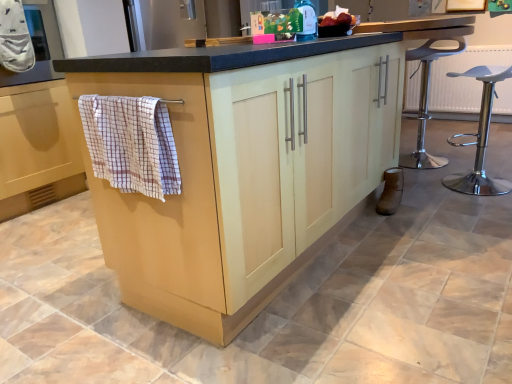
Find the location of a particular element. checkered fabric bath towel at left, the 1th bath towel when ordered from right to left is located at coordinates (131, 143).

What is the approximate height of checkered fabric bath towel at left, arranged as the 1th bath towel when viewed from the front?

The height of checkered fabric bath towel at left, arranged as the 1th bath towel when viewed from the front, is 12.49 inches.

Identify the location of green matte bottle at upper center. The height and width of the screenshot is (384, 512). (307, 20).

Find the location of `checkered fabric bath towel at left, arranged as the 1th bath towel when viewed from the front`. checkered fabric bath towel at left, arranged as the 1th bath towel when viewed from the front is located at coordinates (131, 143).

I want to click on the 2nd bath towel in front of the brown suede boot at lower right, so click(131, 143).

Considering the relative sizes of brown suede boot at lower right and checkered fabric bath towel at left, the 1th bath towel when ordered from right to left, in the image provided, is brown suede boot at lower right wider than checkered fabric bath towel at left, the 1th bath towel when ordered from right to left,?

In fact, brown suede boot at lower right might be narrower than checkered fabric bath towel at left, the 1th bath towel when ordered from right to left.

Is brown suede boot at lower right completely or partially outside of checkered fabric bath towel at left, acting as the 2th bath towel starting from the left?

brown suede boot at lower right lies outside checkered fabric bath towel at left, acting as the 2th bath towel starting from the left,'s area.

Who is smaller, brown suede boot at lower right or checkered fabric bath towel at left, the 2th bath towel in the back-to-front sequence?

brown suede boot at lower right.

Which of these two, brown suede boot at lower right or white plastic stool at right, stands shorter?

brown suede boot at lower right is shorter.

Which is in front, brown suede boot at lower right or white plastic stool at right?

white plastic stool at right is more forward.

Which of these two, brown suede boot at lower right or white plastic stool at right, is thinner?

brown suede boot at lower right.

From a real-world perspective, which is physically below, brown suede boot at lower right or white plastic stool at right?

brown suede boot at lower right is physically lower.

Based on the photo, how different are the orientations of white plastic stool at right and white cotton oven mitt at upper left, the 1th bath towel viewed from the left, in degrees?

The angular difference between white plastic stool at right and white cotton oven mitt at upper left, the 1th bath towel viewed from the left, is 166 degrees.

From a real-world perspective, between white plastic stool at right and white cotton oven mitt at upper left, the second bath towel when ordered from right to left, who is vertically higher?

white cotton oven mitt at upper left, the second bath towel when ordered from right to left, from a real-world perspective.

From the image's perspective, would you say white plastic stool at right is positioned over white cotton oven mitt at upper left, the first bath towel in the back-to-front sequence?

No, from the image's perspective, white plastic stool at right is not over white cotton oven mitt at upper left, the first bath towel in the back-to-front sequence.

Considering the relative sizes of white plastic stool at right and white cotton oven mitt at upper left, the second bath towel when ordered from right to left, in the image provided, is white plastic stool at right thinner than white cotton oven mitt at upper left, the second bath towel when ordered from right to left,?

No, white plastic stool at right is not thinner than white cotton oven mitt at upper left, the second bath towel when ordered from right to left.

Which of these two, matte gray oven at upper left or white plastic stool at right, is smaller?

white plastic stool at right.

I want to click on oven above the white plastic stool at right (from the image's perspective), so click(x=38, y=45).

Looking at this image, considering the sizes of objects matte gray oven at upper left and white plastic stool at right in the image provided, who is thinner, matte gray oven at upper left or white plastic stool at right?

Thinner between the two is white plastic stool at right.

Between white cotton oven mitt at upper left, the 1th bath towel viewed from the left, and green matte bottle at upper center, which one is positioned behind?

white cotton oven mitt at upper left, the 1th bath towel viewed from the left, is further from the camera.

Is point (13, 61) behind point (309, 27)?

Yes, it is.

Does white cotton oven mitt at upper left, the 1th bath towel viewed from the left, have a lesser height compared to green matte bottle at upper center?

In fact, white cotton oven mitt at upper left, the 1th bath towel viewed from the left, may be taller than green matte bottle at upper center.

Which is correct: white cotton oven mitt at upper left, the 1th bath towel viewed from the left, is inside green matte bottle at upper center, or outside of it?

white cotton oven mitt at upper left, the 1th bath towel viewed from the left, is outside green matte bottle at upper center.

Consider the image. Measure the distance from white cotton oven mitt at upper left, the first bath towel in the back-to-front sequence, to matte gray oven at upper left.

white cotton oven mitt at upper left, the first bath towel in the back-to-front sequence, is 10.12 centimeters away from matte gray oven at upper left.

From a real-world perspective, between white cotton oven mitt at upper left, the first bath towel in the back-to-front sequence, and matte gray oven at upper left, who is vertically lower?

matte gray oven at upper left is physically lower.

Which point is more forward, (22, 52) or (40, 30)?

The point (22, 52) is more forward.

Between white cotton oven mitt at upper left, which is the 1th bath towel from top to bottom, and matte gray oven at upper left, which one has less height?

white cotton oven mitt at upper left, which is the 1th bath towel from top to bottom.

Which object is further away from the camera, brown suede boot at lower right or white cotton oven mitt at upper left, the second bath towel viewed from the front?

brown suede boot at lower right is further away from the camera.

From a real-world perspective, is brown suede boot at lower right located beneath white cotton oven mitt at upper left, positioned as the 2th bath towel in bottom-to-top order?

Correct, in the physical world, brown suede boot at lower right is lower than white cotton oven mitt at upper left, positioned as the 2th bath towel in bottom-to-top order.

Between brown suede boot at lower right and white cotton oven mitt at upper left, the 1th bath towel viewed from the left, which one appears on the right side from the viewer's perspective?

From the viewer's perspective, brown suede boot at lower right appears more on the right side.

In terms of width, does brown suede boot at lower right look wider or thinner when compared to white cotton oven mitt at upper left, which is the 1th bath towel from top to bottom?

brown suede boot at lower right is wider than white cotton oven mitt at upper left, which is the 1th bath towel from top to bottom.

Locate an element on the screen. The height and width of the screenshot is (384, 512). the 1st bath towel directly above the brown suede boot at lower right (from a real-world perspective) is located at coordinates (131, 143).

The height and width of the screenshot is (384, 512). I want to click on furniture lying in front of the brown suede boot at lower right, so click(480, 137).

Based on their spatial positions, is white plastic stool at right or green matte bottle at upper center closer to matte gray oven at upper left?

green matte bottle at upper center.

Looking at the image, which one is located further to white plastic stool at right, checkered fabric bath towel at left, acting as the 1th bath towel starting from the bottom, or green matte bottle at upper center?

Based on the image, checkered fabric bath towel at left, acting as the 1th bath towel starting from the bottom, appears to be further to white plastic stool at right.

Based on their spatial positions, is white plastic stool at right or matte gray oven at upper left closer to checkered fabric bath towel at left, acting as the 1th bath towel starting from the bottom?

matte gray oven at upper left is closer to checkered fabric bath towel at left, acting as the 1th bath towel starting from the bottom.

Which object lies further to the anchor point checkered fabric bath towel at left, acting as the 1th bath towel starting from the bottom, white cotton oven mitt at upper left, the second bath towel viewed from the front, or brown suede boot at lower right?

brown suede boot at lower right is positioned further to the anchor checkered fabric bath towel at left, acting as the 1th bath towel starting from the bottom.

Considering their positions, is matte gray oven at upper left positioned further to white plastic stool at right than white cotton oven mitt at upper left, the second bath towel viewed from the front?

The object further to white plastic stool at right is white cotton oven mitt at upper left, the second bath towel viewed from the front.

From the image, which object appears to be farther from matte gray oven at upper left, brown suede boot at lower right or white plastic stool at right?

white plastic stool at right.

From the image, which object appears to be nearer to matte gray oven at upper left, brown suede boot at lower right or green matte bottle at upper center?

Among the two, green matte bottle at upper center is located nearer to matte gray oven at upper left.

Looking at the image, which one is located further to matte gray oven at upper left, brown suede boot at lower right or checkered fabric bath towel at left, the 1th bath towel when ordered from right to left?

brown suede boot at lower right is further to matte gray oven at upper left.

Locate an element on the screen. This screenshot has width=512, height=384. bottle situated between white cotton oven mitt at upper left, the first bath towel in the back-to-front sequence, and brown suede boot at lower right from left to right is located at coordinates (307, 20).

Where is `bath towel between white cotton oven mitt at upper left, the second bath towel viewed from the front, and white plastic stool at right from left to right`? Image resolution: width=512 pixels, height=384 pixels. bath towel between white cotton oven mitt at upper left, the second bath towel viewed from the front, and white plastic stool at right from left to right is located at coordinates (131, 143).

Find the location of a particular element. footwear between green matte bottle at upper center and white plastic stool at right in the horizontal direction is located at coordinates (391, 191).

Where is `bottle situated between white cotton oven mitt at upper left, positioned as the 2th bath towel in bottom-to-top order, and white plastic stool at right from left to right`? The height and width of the screenshot is (384, 512). bottle situated between white cotton oven mitt at upper left, positioned as the 2th bath towel in bottom-to-top order, and white plastic stool at right from left to right is located at coordinates (307, 20).